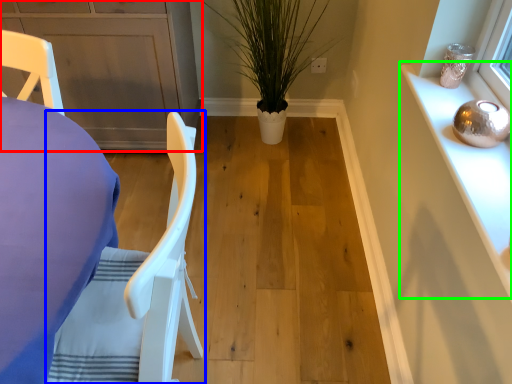
Question: Considering the real-world distances, which object is closest to cabinetry (highlighted by a red box)? chair (highlighted by a blue box) or cabinetry (highlighted by a green box).

Choices:
 (A) chair
 (B) cabinetry

Answer: (A)